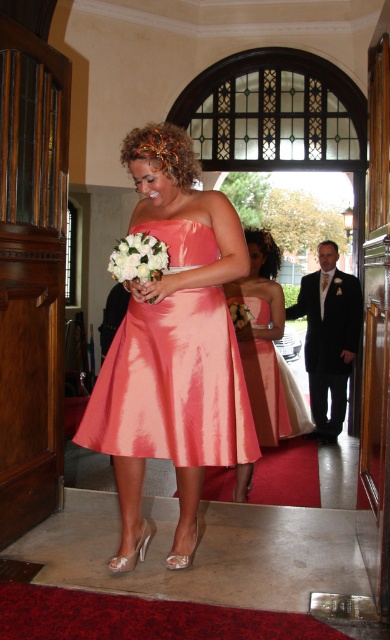
You are a photographer at a wedding event and need to capture a photo of the shiny coral dress at center and the white silk bouquet at center. Based on their positions, which object should you focus on first if you want to ensure both are in frame without moving the camera?

The shiny coral dress at center is positioned on the right side of the white silk bouquet at center. To capture both in frame, focus on the white silk bouquet at center first as it is on the left, ensuring the dress on the right remains within the shot.

Looking at this image, you are a photographer at a wedding venue. You need to position a camera to capture both the shiny pink dress at center and the shiny coral dress at center in the same frame. The camera has a maximum horizontal field of view of 2.5 inches. Can you fit both dresses in the frame?

The shiny pink dress at center and shiny coral dress at center are 2.65 inches apart, which exceeds the camera field of view of 2.5 inches. Therefore, both dresses cannot be captured in the same frame.